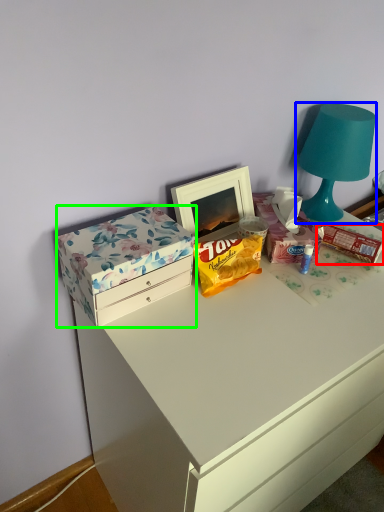
Question: Which object is the closest to the snack (highlighted by a red box)? Choose among these: lamp (highlighted by a blue box) or box (highlighted by a green box).

Choices:
 (A) lamp
 (B) box

Answer: (A)